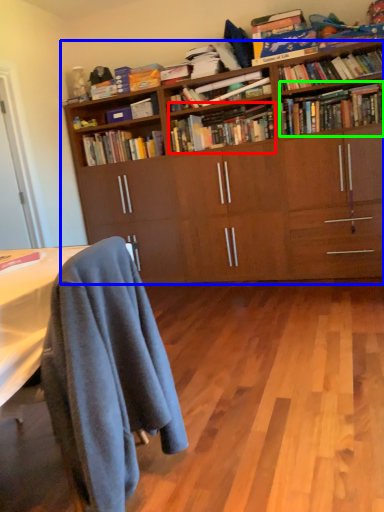
Question: Based on their relative distances, which object is nearer to book (highlighted by a red box)? Choose from bookcase (highlighted by a blue box) and book (highlighted by a green box).

Choices:
 (A) bookcase
 (B) book

Answer: (A)